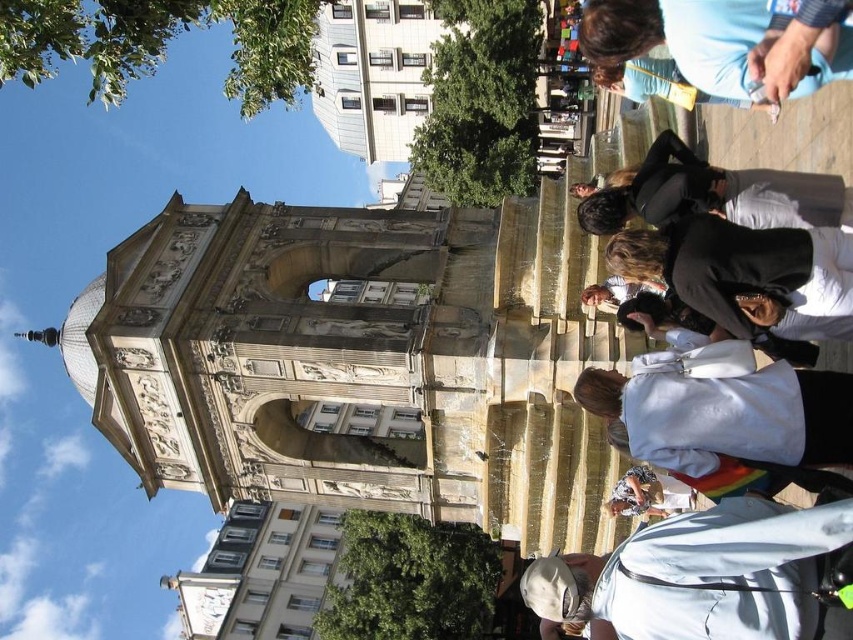
Describe the element at coordinates (286, 356) in the screenshot. The image size is (853, 640). I see `stone archway at center` at that location.

Is stone archway at center shorter than black matte jacket at center?

No.

In the scene shown: Who is more distant from viewer, (265, 394) or (648, 272)?

The point (265, 394) is more distant.

The width and height of the screenshot is (853, 640). Find the location of `stone archway at center`. stone archway at center is located at coordinates (286, 356).

From the picture: Can you confirm if stone archway at center is positioned to the left of denim jacket at lower right?

Indeed, stone archway at center is positioned on the left side of denim jacket at lower right.

Can you confirm if stone archway at center is bigger than denim jacket at lower right?

Correct, stone archway at center is larger in size than denim jacket at lower right.

Does point (183, 234) come in front of point (642, 486)?

That is False.

You are a GUI agent. You are given a task and a screenshot of the screen. Output one action in this format:
    pyautogui.click(x=<x>, y=<y>)
    Task: Click on the stone archway at center
    Image resolution: width=853 pixels, height=640 pixels.
    Given the screenshot: What is the action you would take?
    pyautogui.click(x=286, y=356)

Who is positioned more to the right, stone archway at center or black leather jacket at upper right?

Positioned to the right is black leather jacket at upper right.

Who is shorter, stone archway at center or black leather jacket at upper right?

black leather jacket at upper right is shorter.

Is point (248, 294) farther from camera compared to point (666, 134)?

Yes, it is behind point (666, 134).

The height and width of the screenshot is (640, 853). In order to click on stone archway at center in this screenshot , I will do `click(286, 356)`.